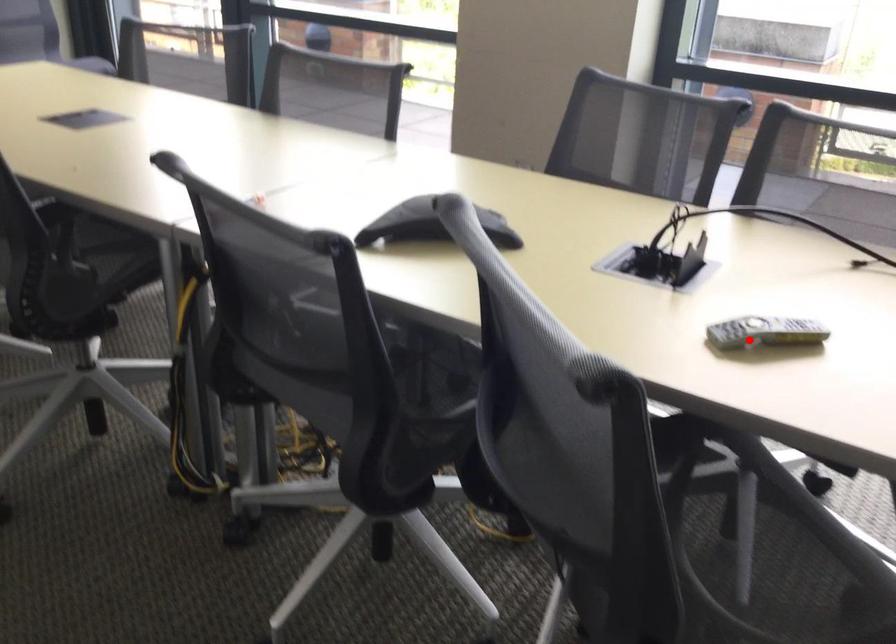
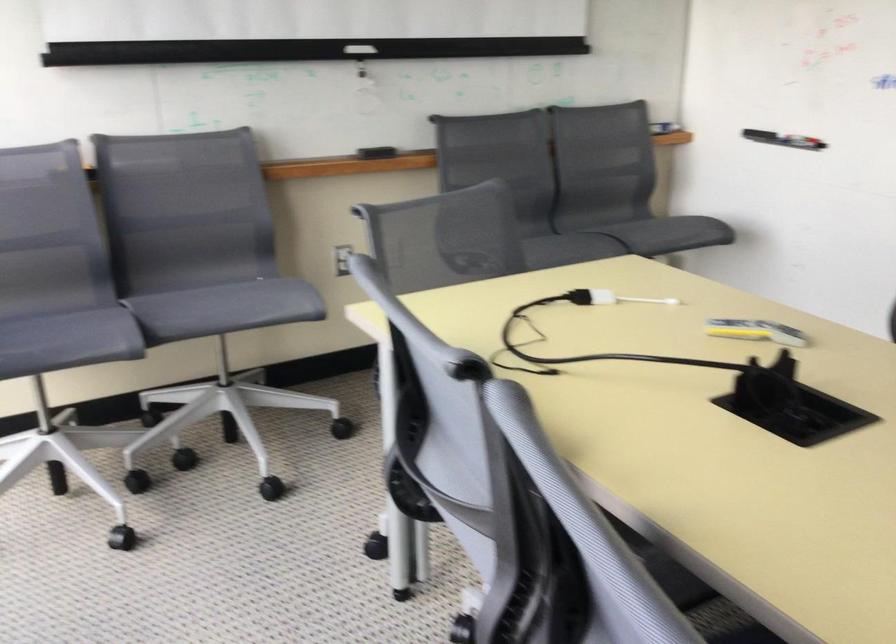
Where in the second image is the point corresponding to the highlighted location from the first image?

(755, 330)